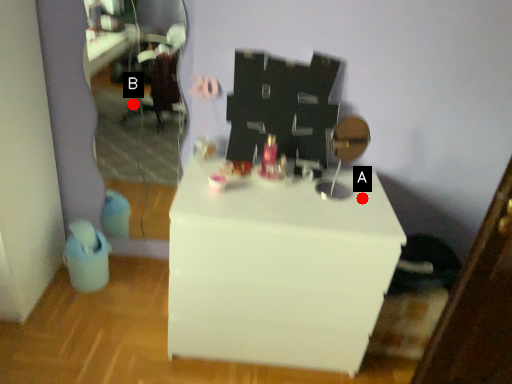
Question: Two points are circled on the image, labeled by A and B beside each circle. Which point is farther to the camera?

Choices:
 (A) A is further
 (B) B is further

Answer: (B)